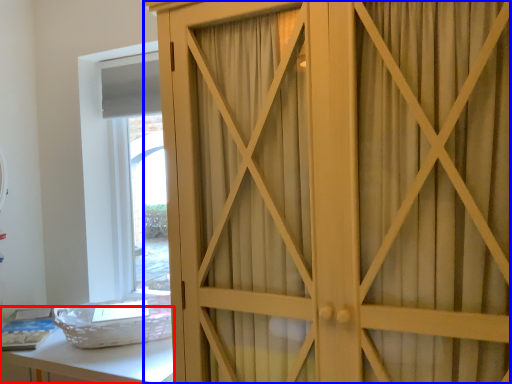
Question: Which of the following is the farthest to the observer, vanity (highlighted by a red box) or cupboard (highlighted by a blue box)?

Choices:
 (A) vanity
 (B) cupboard

Answer: (A)